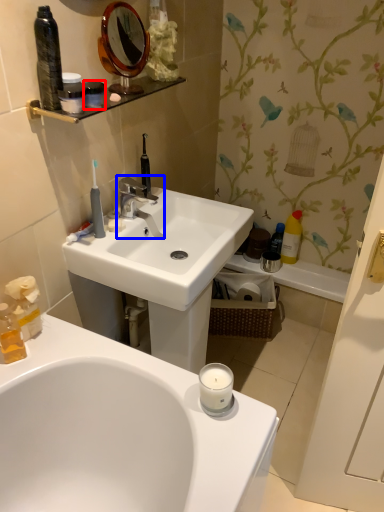
Question: Which point is closer to the camera, mouthwash (highlighted by a red box) or tap (highlighted by a blue box)?

Choices:
 (A) mouthwash
 (B) tap

Answer: (A)